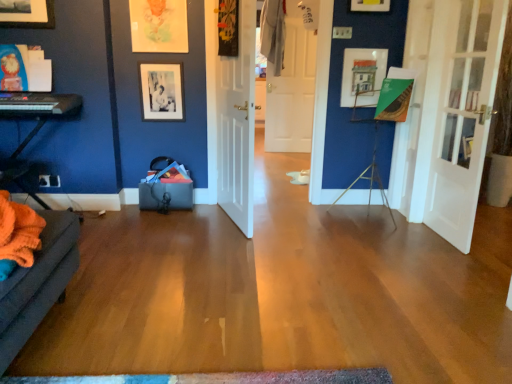
Where is `vacant space that's between multicolored woven mat at lower center and metallic tripod at center-right`? This screenshot has height=384, width=512. vacant space that's between multicolored woven mat at lower center and metallic tripod at center-right is located at coordinates (285, 293).